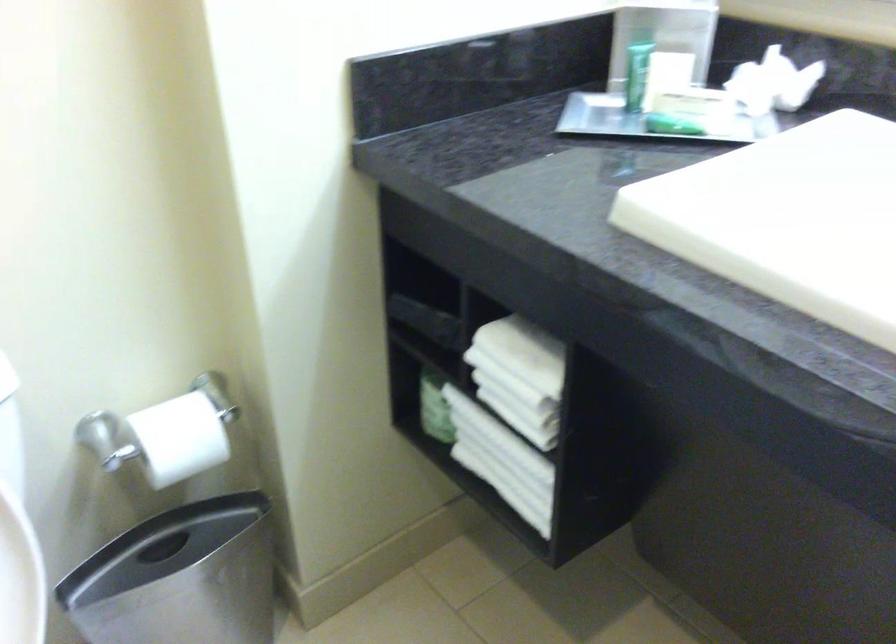
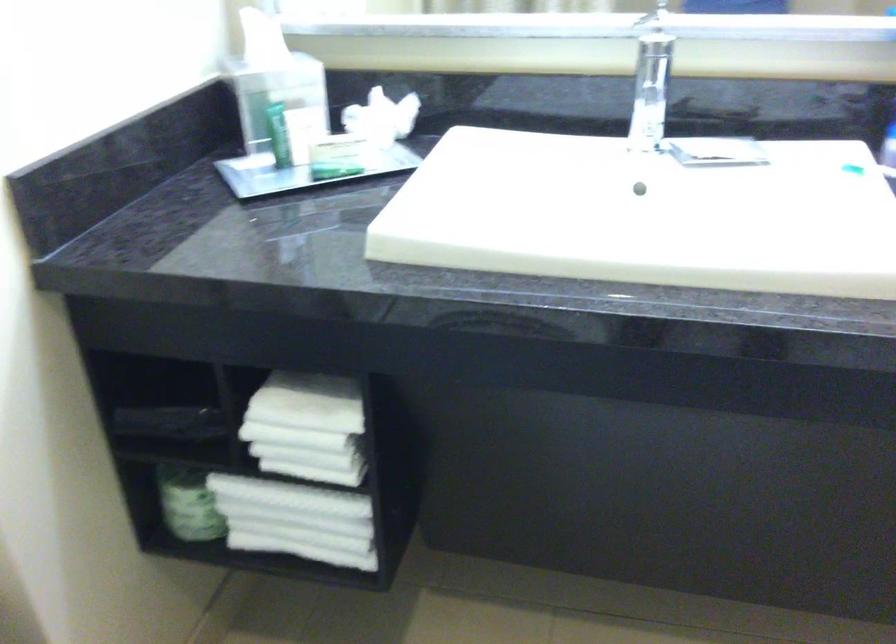
The point at [514,375] is marked in the first image. Where is the corresponding point in the second image?

(307, 428)